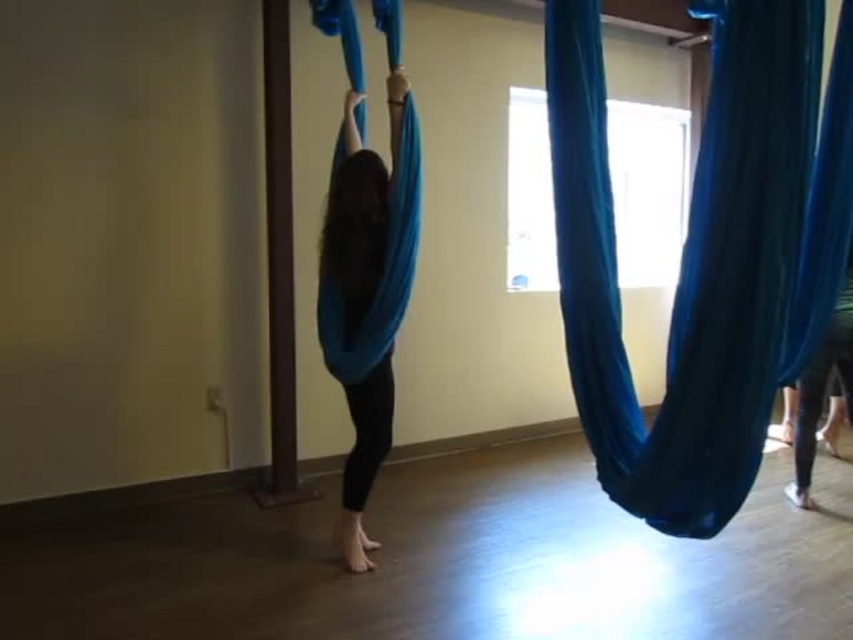
Which is more to the left, blue fabric hammock at right or matte blue fabric at center?

Positioned to the left is matte blue fabric at center.

Looking at this image, is the position of blue fabric hammock at right less distant than that of matte blue fabric at center?

Yes, it is.

Describe the element at coordinates (705, 252) in the screenshot. The height and width of the screenshot is (640, 853). I see `blue fabric hammock at right` at that location.

Image resolution: width=853 pixels, height=640 pixels. I want to click on blue fabric hammock at right, so click(705, 252).